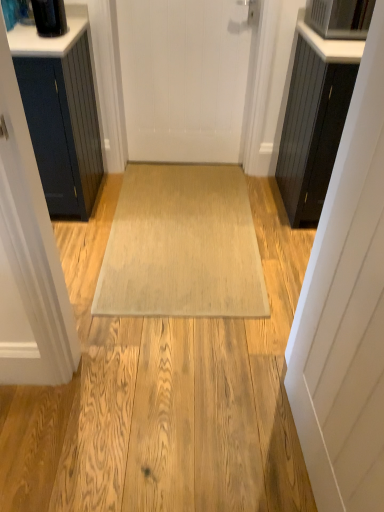
Identify the location of vacant space behind white matte door at right, the second door in the left-to-right sequence. Image resolution: width=384 pixels, height=512 pixels. (262, 393).